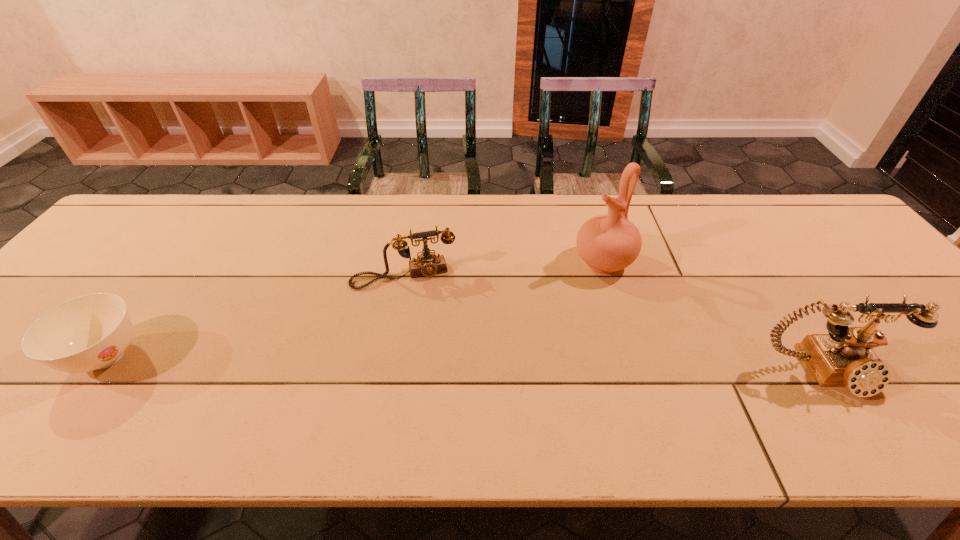
Find the location of a particular element. This screenshot has width=960, height=540. vacant spot on the desktop that is between the sugar bowl and the taller telephone and is positioned on the spout of the third object from left to right is located at coordinates (481, 364).

Image resolution: width=960 pixels, height=540 pixels. I want to click on vacant spot on the desktop that is between the leftmost object and the right telephone and is positioned on the front-facing side of the third tallest object, so click(x=420, y=363).